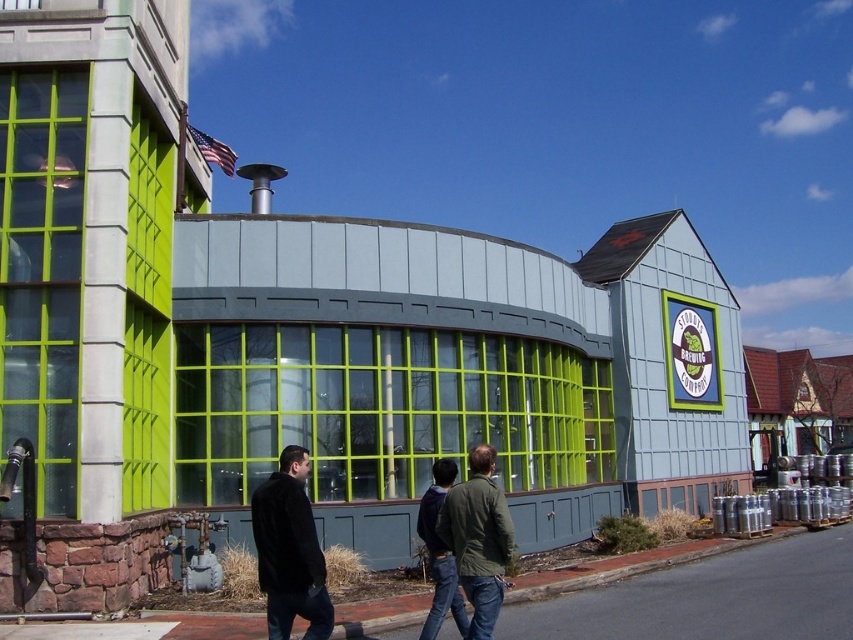
Is point (422, 524) more distant than point (283, 520)?

Yes, point (422, 524) is farther from viewer.

Describe the element at coordinates (465, 544) in the screenshot. I see `green fabric jacket at center` at that location.

What do you see at coordinates (465, 544) in the screenshot?
I see `green fabric jacket at center` at bounding box center [465, 544].

Locate an element on the screen. This screenshot has height=640, width=853. green fabric jacket at center is located at coordinates (465, 544).

How distant is smooth asphalt road at lower center from green fabric jacket at center?

They are 4.24 meters apart.

What do you see at coordinates (701, 593) in the screenshot? Image resolution: width=853 pixels, height=640 pixels. I see `smooth asphalt road at lower center` at bounding box center [701, 593].

Locate an element on the screen. smooth asphalt road at lower center is located at coordinates (701, 593).

Can you confirm if smooth asphalt road at lower center is positioned below black fuzzy coat at center?

Correct, smooth asphalt road at lower center is located below black fuzzy coat at center.

Measure the distance between point (659, 566) and camera.

Point (659, 566) and camera are 54.26 feet apart from each other.

You are a GUI agent. You are given a task and a screenshot of the screen. Output one action in this format:
    pyautogui.click(x=<x>, y=<y>)
    Task: Click on the smooth asphalt road at lower center
    
    Given the screenshot: What is the action you would take?
    pyautogui.click(x=701, y=593)